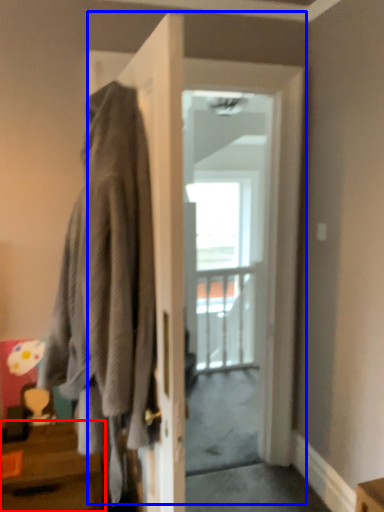
Question: Which object appears closest to the camera in this image, table (highlighted by a red box) or door (highlighted by a blue box)?

Choices:
 (A) table
 (B) door

Answer: (A)